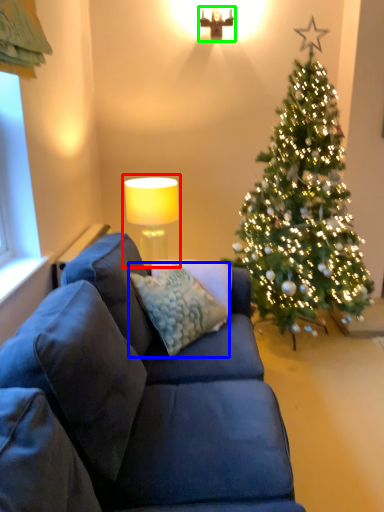
Question: Based on their relative distances, which object is nearer to table lamp (highlighted by a red box)? Choose from pillow (highlighted by a blue box) and lamp (highlighted by a green box).

Choices:
 (A) pillow
 (B) lamp

Answer: (A)